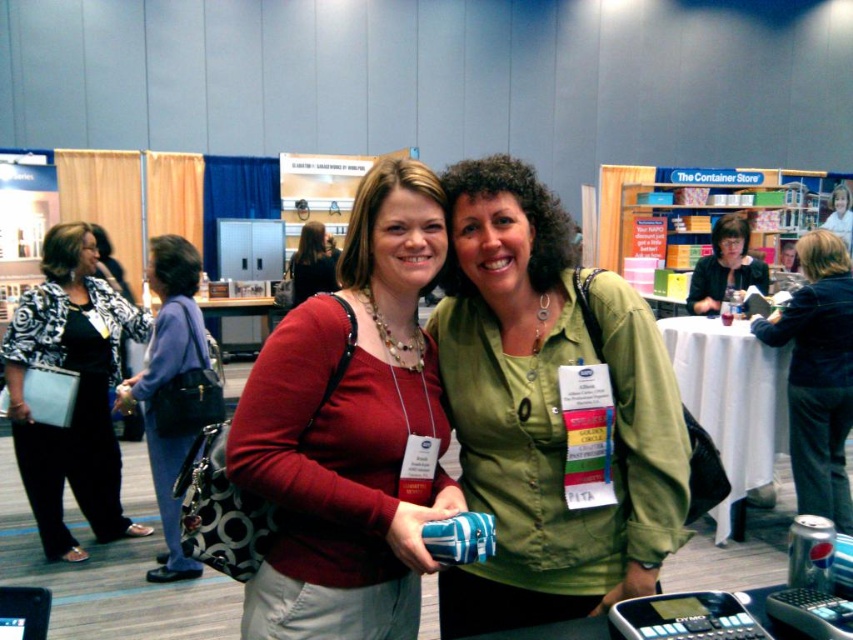
Can you confirm if matte red shirt at center is positioned below matte black purse at left?

No.

Who is lower down, matte red shirt at center or matte black purse at left?

Positioned lower is matte black purse at left.

Is point (355, 522) positioned behind point (198, 388)?

No, (355, 522) is in front of (198, 388).

The width and height of the screenshot is (853, 640). Identify the location of matte red shirt at center. (351, 429).

Between dark blue denim jacket at center and matte black purse at center, which one has less height?

With less height is matte black purse at center.

What do you see at coordinates (817, 374) in the screenshot? This screenshot has width=853, height=640. I see `dark blue denim jacket at center` at bounding box center [817, 374].

Describe the element at coordinates (817, 374) in the screenshot. I see `dark blue denim jacket at center` at that location.

The image size is (853, 640). I want to click on dark blue denim jacket at center, so click(x=817, y=374).

Is point (519, 538) more distant than point (737, 240)?

No, it is in front of (737, 240).

The width and height of the screenshot is (853, 640). In order to click on green matte shirt at center in this screenshot , I will do `click(547, 410)`.